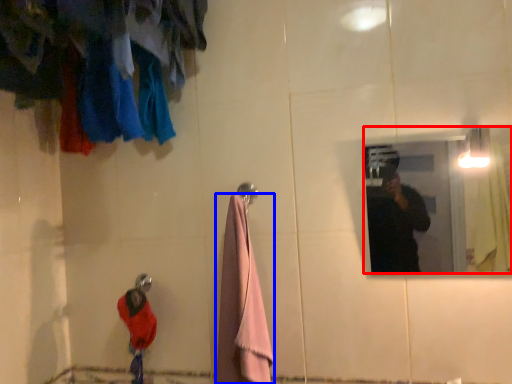
Question: Among these objects, which one is farthest to the camera, mirror (highlighted by a red box) or towel/napkin (highlighted by a blue box)?

Choices:
 (A) mirror
 (B) towel/napkin

Answer: (B)